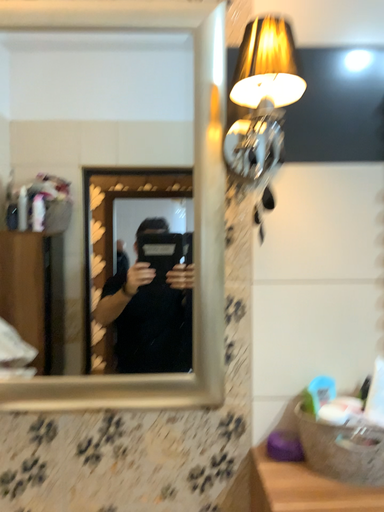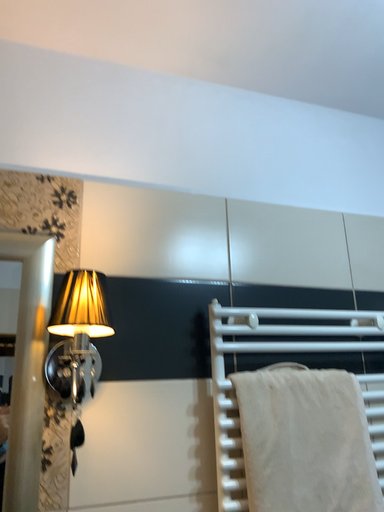
Question: Which way did the camera rotate in the video?

Choices:
 (A) rotated upward
 (B) rotated downward

Answer: (A)